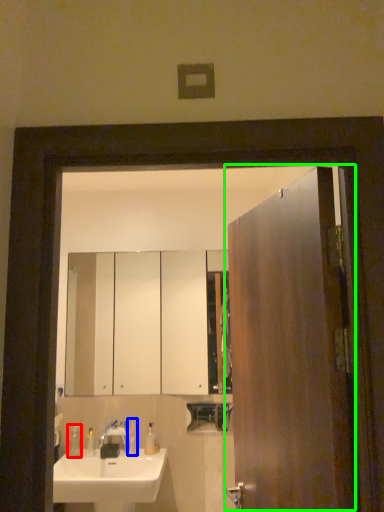
Question: Considering the real-world distances, which object is closest to soap dispenser (highlighted by a red box)? toiletry (highlighted by a blue box) or door (highlighted by a green box).

Choices:
 (A) toiletry
 (B) door

Answer: (A)